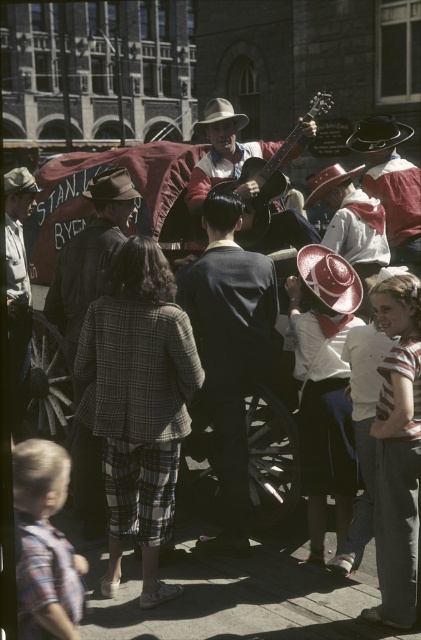
Question: Is matte pink straw hat at center closer to the viewer compared to plaid shirt at lower left?

Choices:
 (A) yes
 (B) no

Answer: (B)

Question: Is plaid fabric jacket at center below plaid shirt at lower left?

Choices:
 (A) no
 (B) yes

Answer: (A)

Question: Which point appears closest to the camera in this image?

Choices:
 (A) (28, 307)
 (B) (349, 282)

Answer: (B)

Question: Can you confirm if matte pink straw hat at center is thinner than matte black cowboy hat at center?

Choices:
 (A) yes
 (B) no

Answer: (A)

Question: Estimate the real-world distances between objects in this image. Which object is closer to the matte pink straw hat at center?

Choices:
 (A) matte brown guitar at center
 (B) plaid fabric coat at center
 (C) reddish-brown leather hat at upper right

Answer: (B)

Question: Which of the following is the farthest from the observer?

Choices:
 (A) matte pink straw hat at center
 (B) reddish-brown leather hat at upper right
 (C) red felt cowboy hat at center
 (D) light brown felt cowboy hat at center

Answer: (D)